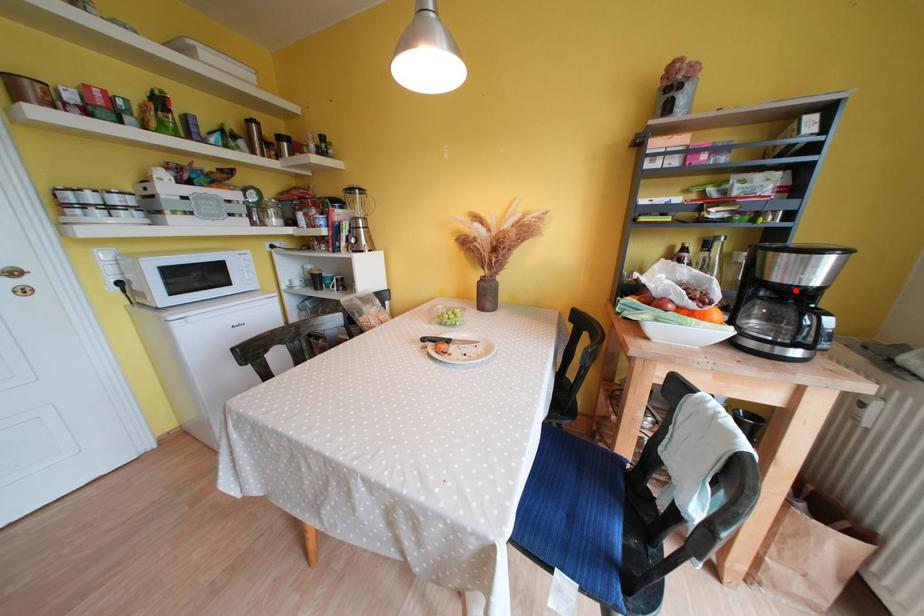
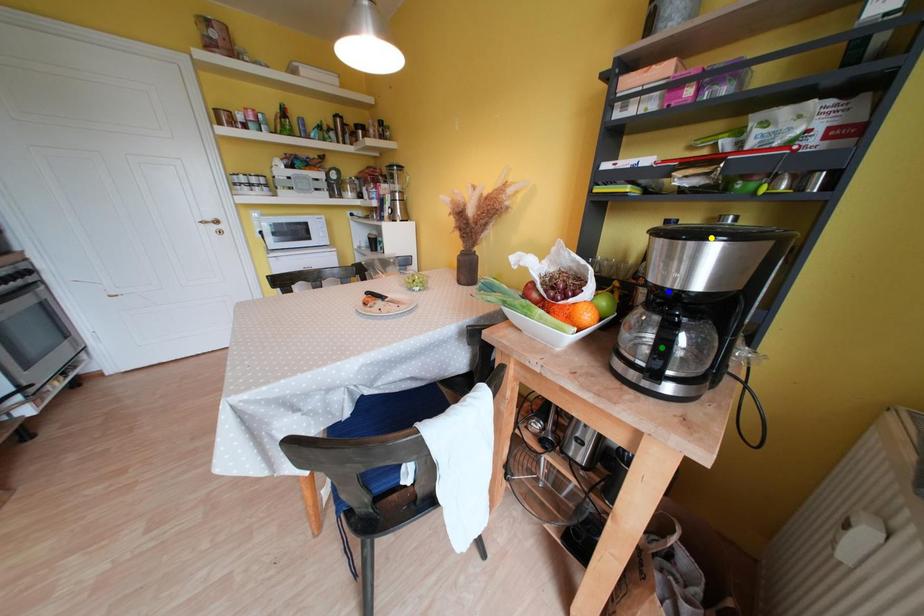
Question: I am providing you with two images of the same scene from different viewpoints. A red point is marked on the first image. You are given multiple points on the second image. Which spot in image 2 lines up with the point in image 1?

Choices:
 (A) yellow point
 (B) blue point
 (C) green point

Answer: (B)